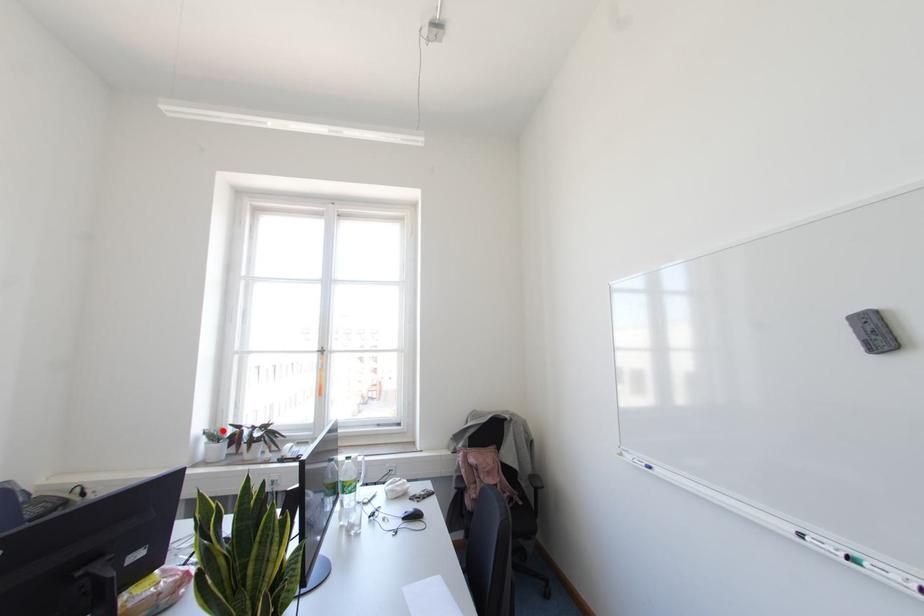
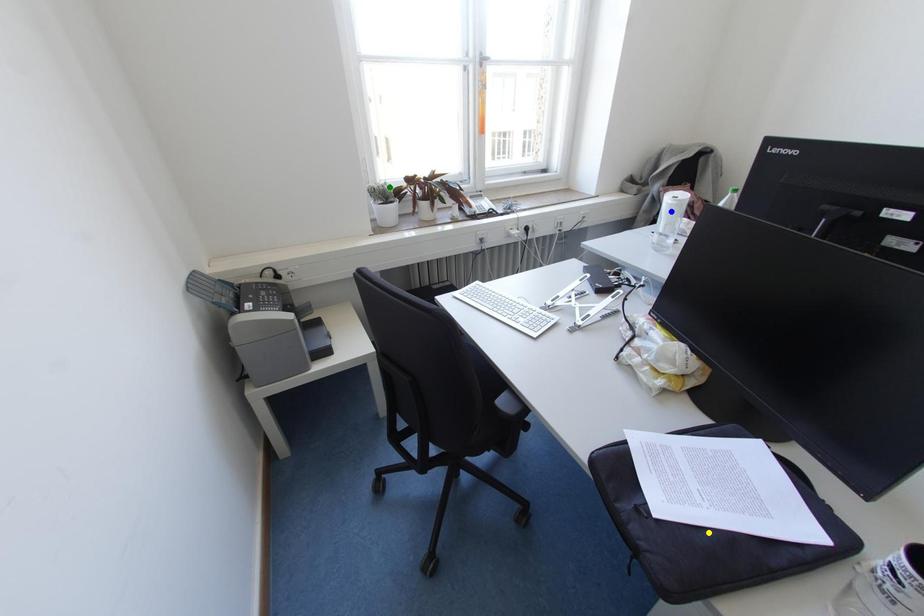
Question: I am providing you with two images of the same scene from different viewpoints. A red point is marked on the first image. You are given multiple points on the second image. Which point in image 2 is actually the same real-world point as the red point in image 1?

Choices:
 (A) yellow point
 (B) green point
 (C) blue point

Answer: (B)